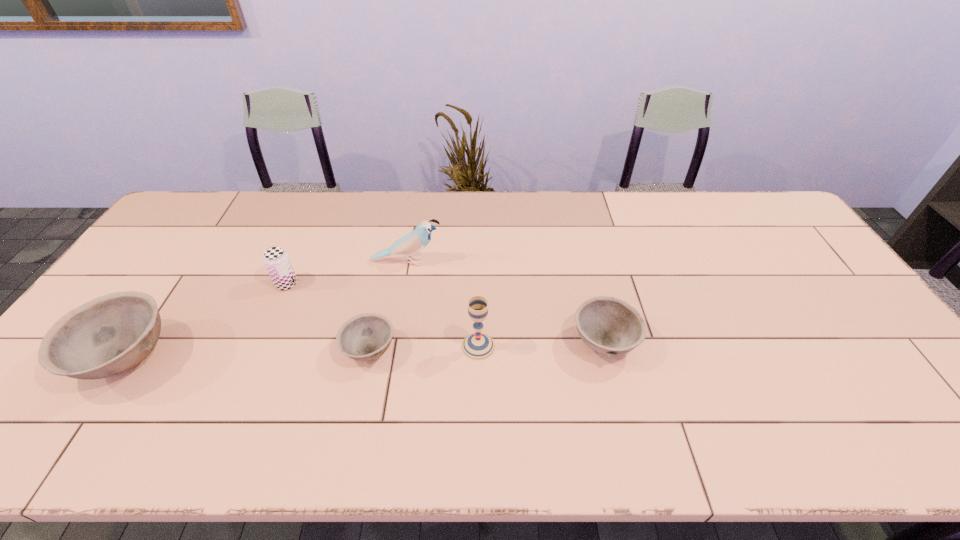
I want to click on the tallest bowl, so click(x=109, y=335).

Where is `the leftmost object`? the leftmost object is located at coordinates (109, 335).

Find the location of a particular element. The height and width of the screenshot is (540, 960). the shortest object is located at coordinates (364, 337).

Where is `the shortest bowl`? the shortest bowl is located at coordinates (364, 337).

Identify the location of the second shortest object. (608, 325).

You are a GUI agent. You are given a task and a screenshot of the screen. Output one action in this format:
    pyautogui.click(x=<x>, y=<y>)
    Task: Click on the rightmost object
    Image resolution: width=960 pixels, height=540 pixels.
    Given the screenshot: What is the action you would take?
    pyautogui.click(x=608, y=325)

Image resolution: width=960 pixels, height=540 pixels. I want to click on bird, so click(x=416, y=240).

Identify the location of the fifth object from right to left. This screenshot has width=960, height=540. tap(276, 259).

Locate an element on the screen. This screenshot has height=540, width=960. the fifth nearest object is located at coordinates (276, 259).

Locate an element on the screen. This screenshot has height=540, width=960. chalice is located at coordinates (477, 346).